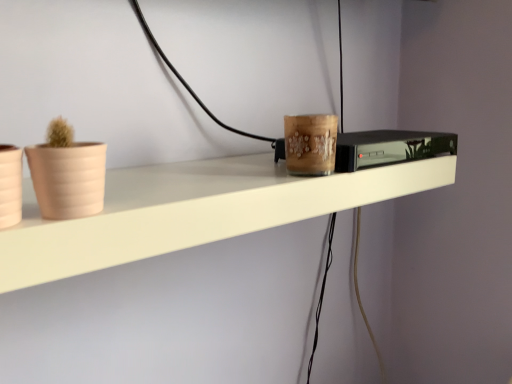
Question: Is black glossy tv at center completely or partially outside of matte beige flowerpot at left, positioned as the 1th flowerpot in left-to-right order?

Choices:
 (A) no
 (B) yes

Answer: (B)

Question: Does black glossy tv at center have a lesser width compared to matte beige flowerpot at left, which is the 2th flowerpot in right-to-left order?

Choices:
 (A) yes
 (B) no

Answer: (B)

Question: Is black glossy tv at center aimed at matte beige flowerpot at left, which is the 2th flowerpot in right-to-left order?

Choices:
 (A) yes
 (B) no

Answer: (B)

Question: Considering the relative positions of black glossy tv at center and matte beige flowerpot at left, positioned as the 1th flowerpot in left-to-right order, in the image provided, is black glossy tv at center to the right of matte beige flowerpot at left, positioned as the 1th flowerpot in left-to-right order, from the viewer's perspective?

Choices:
 (A) yes
 (B) no

Answer: (A)

Question: From a real-world perspective, is black glossy tv at center under matte beige flowerpot at left, positioned as the 1th flowerpot in left-to-right order?

Choices:
 (A) no
 (B) yes

Answer: (B)

Question: Would you say white matte shelf at center is inside or outside black glossy tv at center?

Choices:
 (A) outside
 (B) inside

Answer: (A)

Question: Is white matte shelf at center taller or shorter than black glossy tv at center?

Choices:
 (A) tall
 (B) short

Answer: (A)

Question: From a real-world perspective, is white matte shelf at center positioned above or below black glossy tv at center?

Choices:
 (A) above
 (B) below

Answer: (B)

Question: In terms of width, does white matte shelf at center look wider or thinner when compared to black glossy tv at center?

Choices:
 (A) thin
 (B) wide

Answer: (B)

Question: Is black glossy tv at center to the left or to the right of white matte shelf at center in the image?

Choices:
 (A) right
 (B) left

Answer: (A)

Question: From a real-world perspective, is black glossy tv at center physically located above or below white matte shelf at center?

Choices:
 (A) below
 (B) above

Answer: (B)

Question: In terms of size, does black glossy tv at center appear bigger or smaller than white matte shelf at center?

Choices:
 (A) small
 (B) big

Answer: (A)

Question: Is black glossy tv at center spatially inside white matte shelf at center, or outside of it?

Choices:
 (A) outside
 (B) inside

Answer: (A)

Question: Would you say beige matte flowerpot at left, which ranks as the second flowerpot in left-to-right order, is inside or outside black glossy tv at center?

Choices:
 (A) inside
 (B) outside

Answer: (B)

Question: Considering the positions of beige matte flowerpot at left, the first flowerpot when ordered from right to left, and black glossy tv at center in the image, is beige matte flowerpot at left, the first flowerpot when ordered from right to left, bigger or smaller than black glossy tv at center?

Choices:
 (A) big
 (B) small

Answer: (B)